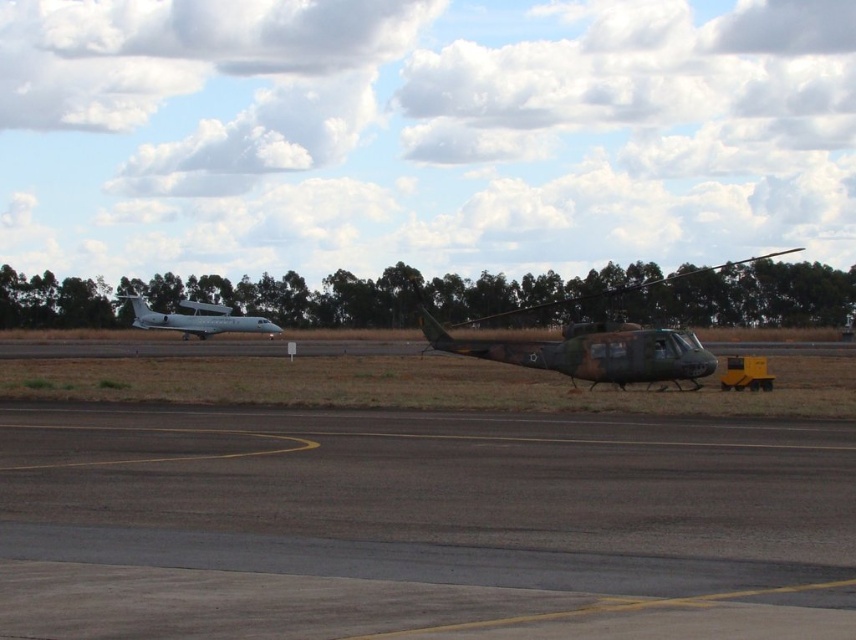
In the scene shown: Can you confirm if dark gray asphalt at center is shorter than camouflage paint helicopter at center?

Yes.

You are a GUI agent. You are given a task and a screenshot of the screen. Output one action in this format:
    pyautogui.click(x=<x>, y=<y>)
    Task: Click on the dark gray asphalt at center
    The width and height of the screenshot is (856, 640).
    Given the screenshot: What is the action you would take?
    pyautogui.click(x=420, y=525)

I want to click on dark gray asphalt at center, so click(420, 525).

At what (x,y) coordinates should I click in order to perform the action: click on camouflage paint helicopter at center. Please return your answer as a coordinate pair (x, y). The image size is (856, 640). Looking at the image, I should click on (589, 349).

Who is positioned more to the left, camouflage paint helicopter at center or silver metallic airplane at left?

silver metallic airplane at left

The width and height of the screenshot is (856, 640). I want to click on camouflage paint helicopter at center, so click(x=589, y=349).

The image size is (856, 640). Identify the location of camouflage paint helicopter at center. (589, 349).

Is dark gray asphalt at center bigger than silver metallic airplane at left?

Incorrect, dark gray asphalt at center is not larger than silver metallic airplane at left.

Is point (141, 451) behind point (217, 332)?

No, (141, 451) is closer to viewer.

The image size is (856, 640). Find the location of `dark gray asphalt at center`. dark gray asphalt at center is located at coordinates (420, 525).